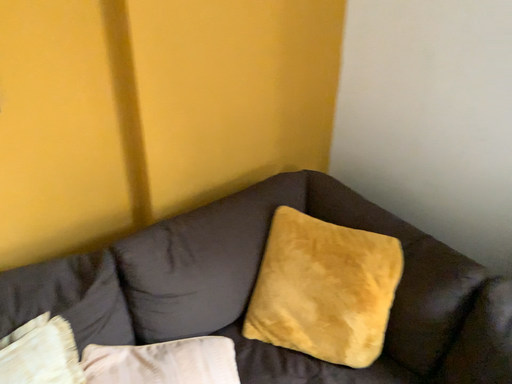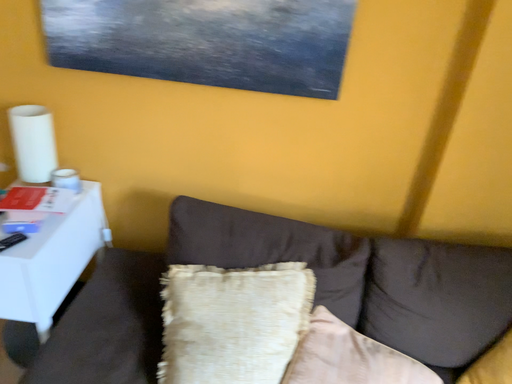
Question: How did the camera likely rotate when shooting the video?

Choices:
 (A) rotated upward
 (B) rotated downward

Answer: (A)